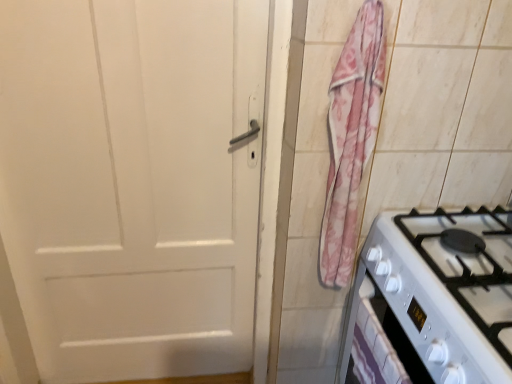
Question: Can you confirm if white glossy gas stove at lower right is wider than white glossy drawer at lower right?

Choices:
 (A) yes
 (B) no

Answer: (A)

Question: Is white glossy gas stove at lower right bigger than white glossy drawer at lower right?

Choices:
 (A) no
 (B) yes

Answer: (B)

Question: From a real-world perspective, is white glossy gas stove at lower right on white glossy drawer at lower right?

Choices:
 (A) no
 (B) yes

Answer: (B)

Question: Does white glossy gas stove at lower right appear on the right side of white glossy drawer at lower right?

Choices:
 (A) yes
 (B) no

Answer: (A)

Question: Is white glossy drawer at lower right a part of white glossy gas stove at lower right?

Choices:
 (A) yes
 (B) no

Answer: (B)

Question: From the image's perspective, is white glossy gas stove at lower right located above white glossy drawer at lower right?

Choices:
 (A) no
 (B) yes

Answer: (B)

Question: Is pink floral fabric at right completely or partially inside white glossy gas stove at lower right?

Choices:
 (A) yes
 (B) no

Answer: (B)

Question: From a real-world perspective, is white glossy gas stove at lower right positioned under pink floral fabric at right based on gravity?

Choices:
 (A) yes
 (B) no

Answer: (A)

Question: Considering the relative sizes of white glossy gas stove at lower right and pink floral fabric at right in the image provided, is white glossy gas stove at lower right bigger than pink floral fabric at right?

Choices:
 (A) yes
 (B) no

Answer: (A)

Question: Is white glossy gas stove at lower right positioned in front of pink floral fabric at right?

Choices:
 (A) no
 (B) yes

Answer: (B)

Question: Can we say white glossy gas stove at lower right lies outside pink floral fabric at right?

Choices:
 (A) yes
 (B) no

Answer: (A)

Question: Are white glossy gas stove at lower right and pink floral fabric at right making contact?

Choices:
 (A) yes
 (B) no

Answer: (B)

Question: Does pink floral fabric at right lie in front of white glossy drawer at lower right?

Choices:
 (A) no
 (B) yes

Answer: (A)